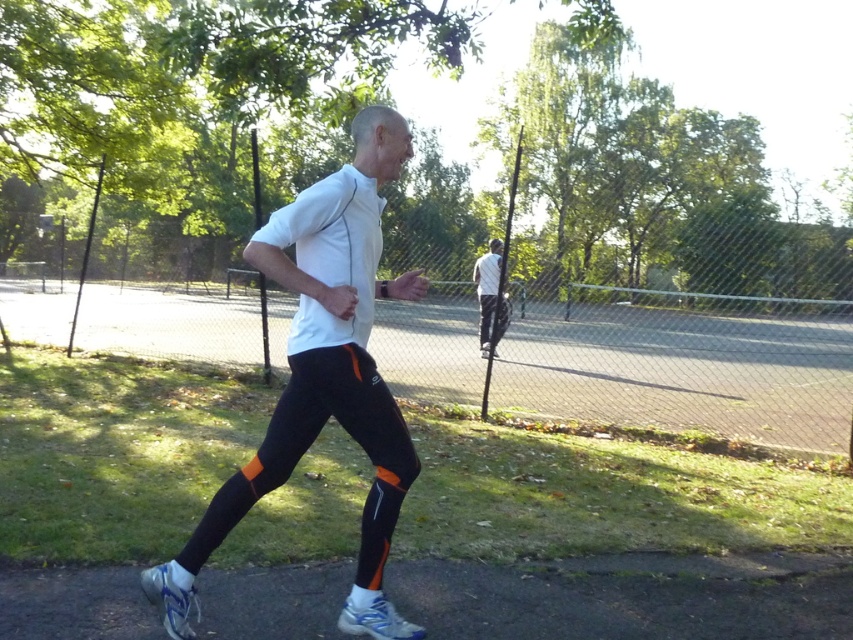
Can you confirm if white matte running pants at center is thinner than white mesh running shoe at lower left?

No.

Is white matte running pants at center wider than white mesh running shoe at lower left?

Indeed, white matte running pants at center has a greater width compared to white mesh running shoe at lower left.

You are a GUI agent. You are given a task and a screenshot of the screen. Output one action in this format:
    pyautogui.click(x=<x>, y=<y>)
    Task: Click on the white matte running pants at center
    This screenshot has height=640, width=853.
    Given the screenshot: What is the action you would take?
    pyautogui.click(x=332, y=362)

Looking at this image, is white mesh running shoe at lower left smaller than white fabric shirt at center?

Yes.

Measure the distance between point (x=158, y=600) and camera.

They are 2.04 meters apart.

Who is more forward, [167,625] or [495,240]?

Point [167,625]

This screenshot has height=640, width=853. In order to click on white mesh running shoe at lower left in this screenshot , I will do `click(170, 600)`.

Does white matte running pants at center appear under white fabric shirt at center?

Indeed, white matte running pants at center is positioned under white fabric shirt at center.

Which is above, white matte running pants at center or white fabric shirt at center?

white fabric shirt at center

The image size is (853, 640). Find the location of `white matte running pants at center`. white matte running pants at center is located at coordinates (332, 362).